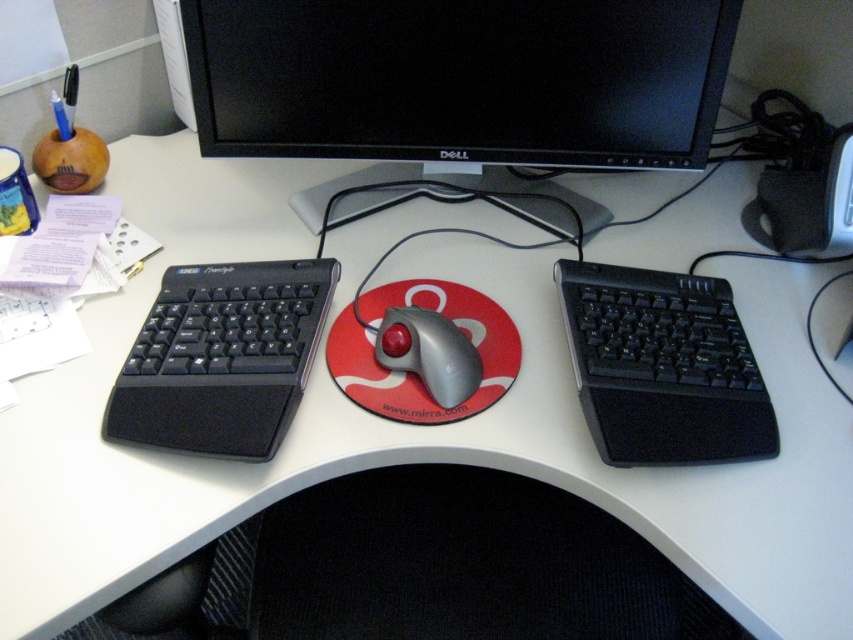
Is black plastic monitor at upper center above black textured keyboard at right?

Correct, black plastic monitor at upper center is located above black textured keyboard at right.

Does black plastic monitor at upper center have a greater height compared to black textured keyboard at right?

Indeed, black plastic monitor at upper center has a greater height compared to black textured keyboard at right.

The image size is (853, 640). I want to click on black plastic monitor at upper center, so click(x=459, y=88).

Which is behind, point (276, 269) or point (463, 371)?

The point (276, 269) is behind.

Between point (224, 378) and point (451, 387), which one is positioned in front?

Point (224, 378) is more forward.

At what (x,y) coordinates should I click in order to perform the action: click on black matte keyboard at left. Please return your answer as a coordinate pair (x, y). This screenshot has width=853, height=640. Looking at the image, I should click on pos(222,356).

Between black plastic monitor at upper center and metallic gray trackball at center, which one has more height?

Standing taller between the two is black plastic monitor at upper center.

This screenshot has width=853, height=640. What do you see at coordinates (459, 88) in the screenshot? I see `black plastic monitor at upper center` at bounding box center [459, 88].

Locate an element on the screen. Image resolution: width=853 pixels, height=640 pixels. black plastic monitor at upper center is located at coordinates (459, 88).